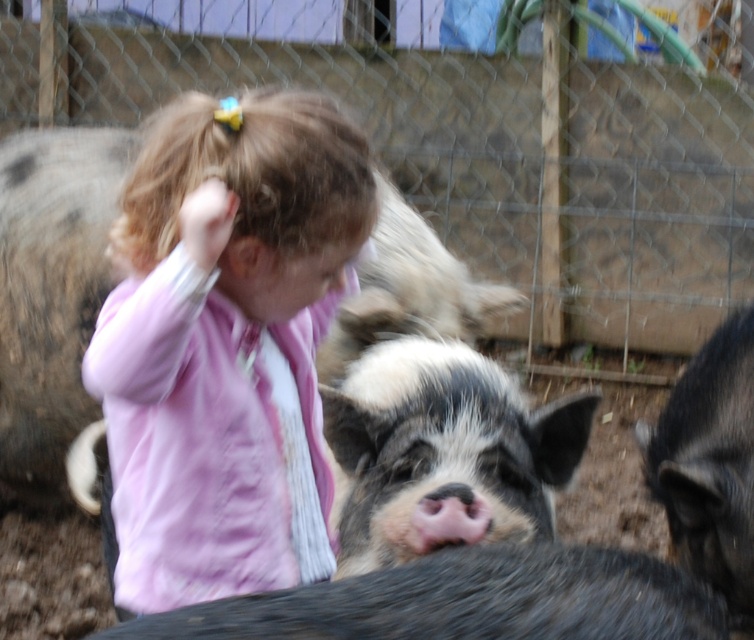
Question: Does speckled fur pig at center appear under black fuzzy pig at lower right?

Choices:
 (A) no
 (B) yes

Answer: (A)

Question: Does pink fabric at center have a lesser width compared to speckled fur pig at center?

Choices:
 (A) yes
 (B) no

Answer: (A)

Question: Which object is closer to the camera taking this photo?

Choices:
 (A) pink fabric at center
 (B) black fuzzy pig at lower right

Answer: (A)

Question: Which of the following is the closest to the observer?

Choices:
 (A) speckled fur pig at center
 (B) pink fabric at center
 (C) black fuzzy pig at lower right
 (D) black fuzzy pig at center

Answer: (D)

Question: Can you confirm if speckled fur pig at center is smaller than black fuzzy pig at lower right?

Choices:
 (A) yes
 (B) no

Answer: (B)

Question: Which of the following is the closest to the observer?

Choices:
 (A) pink fabric at center
 (B) speckled fur pig at center
 (C) black fuzzy pig at lower right
 (D) black fuzzy pig at center

Answer: (D)